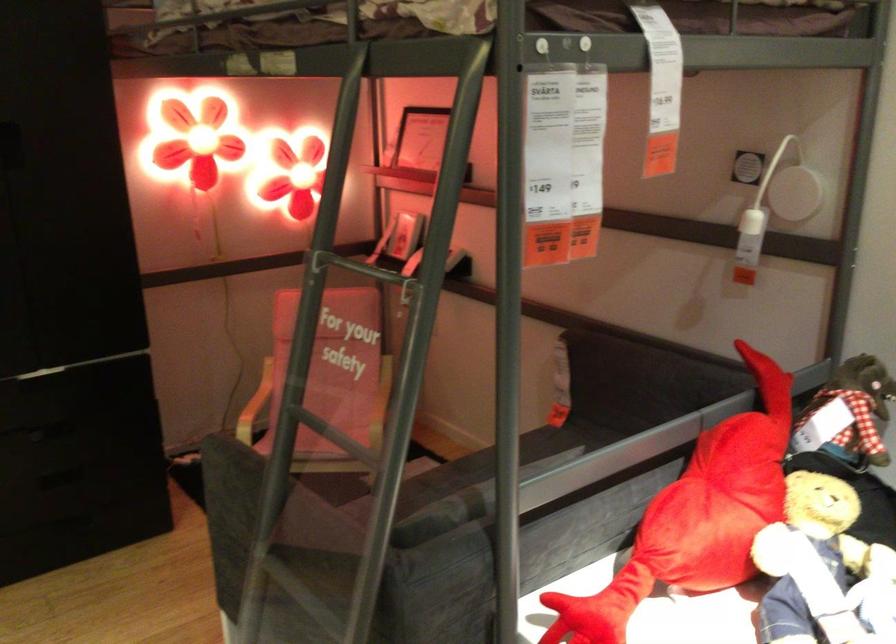
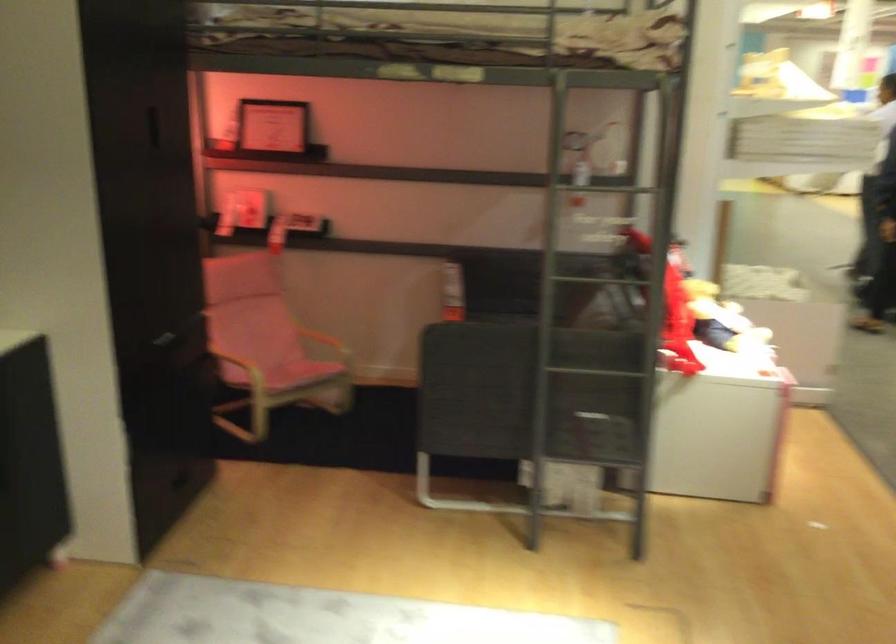
Locate, in the second image, the point that corresponds to pixel 535 393 in the first image.

(452, 292)